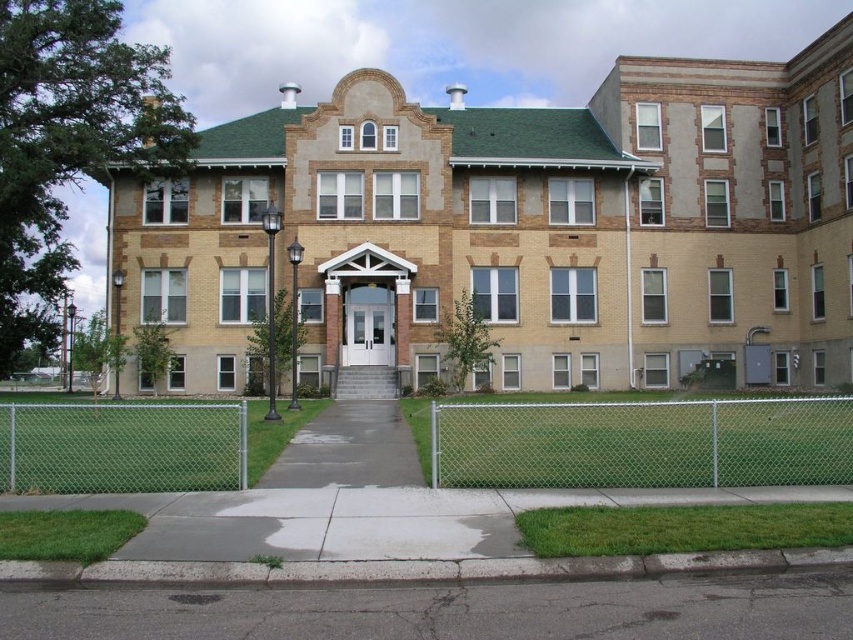
Who is lower down, green chain-link fence at lower left or gray concrete sidewalk at center?

gray concrete sidewalk at center

Describe the element at coordinates (122, 448) in the screenshot. I see `green chain-link fence at lower left` at that location.

Is point (64, 480) in front of point (344, 476)?

Yes.

This screenshot has height=640, width=853. Find the location of `green chain-link fence at lower left`. green chain-link fence at lower left is located at coordinates (122, 448).

Does gray asphalt at lower center come behind green chain-link fence at lower left?

No, it is not.

Is gray asphalt at lower center above green chain-link fence at lower left?

Actually, gray asphalt at lower center is below green chain-link fence at lower left.

Identify the location of gray asphalt at lower center. (448, 609).

The height and width of the screenshot is (640, 853). In order to click on gray asphalt at lower center in this screenshot , I will do `click(448, 609)`.

Who is shorter, gray asphalt at lower center or gray concrete sidewalk at center?

Standing shorter between the two is gray asphalt at lower center.

Can you confirm if gray asphalt at lower center is positioned below gray concrete sidewalk at center?

Incorrect, gray asphalt at lower center is not positioned below gray concrete sidewalk at center.

The image size is (853, 640). What do you see at coordinates (448, 609) in the screenshot? I see `gray asphalt at lower center` at bounding box center [448, 609].

The width and height of the screenshot is (853, 640). What are the coordinates of `gray asphalt at lower center` in the screenshot? It's located at (448, 609).